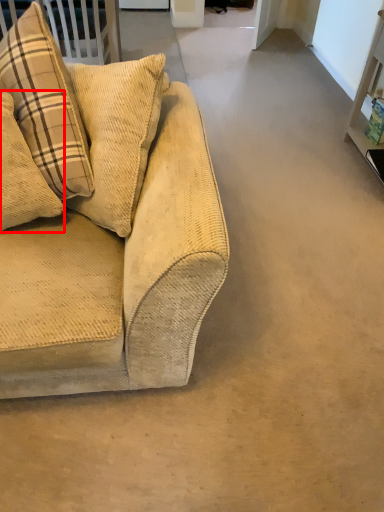
Question: From the image's perspective, what is the correct spatial positioning of pillow (annotated by the red box) in reference to studio couch?

Choices:
 (A) below
 (B) above

Answer: (A)